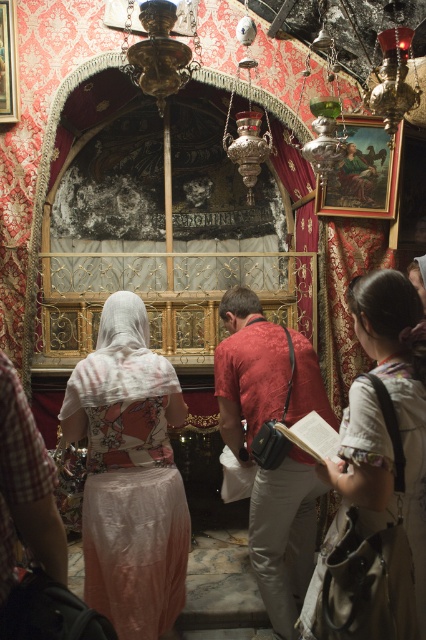
Question: Is light beige fabric at center positioned at the back of pink silk dress at center?

Choices:
 (A) yes
 (B) no

Answer: (A)

Question: Which point is farther from the camera taking this photo?

Choices:
 (A) (101, 390)
 (B) (293, 637)

Answer: (B)

Question: Is light beige fabric at center smaller than red fabric bag at center?

Choices:
 (A) yes
 (B) no

Answer: (A)

Question: Which point is closer to the camera?

Choices:
 (A) (400, 422)
 (B) (284, 602)

Answer: (A)

Question: Can you confirm if light beige fabric at center is positioned below silky pink dress at center?

Choices:
 (A) no
 (B) yes

Answer: (A)

Question: Which is nearer to the silky pink dress at center?

Choices:
 (A) red fabric bag at center
 (B) pink silk dress at center

Answer: (A)